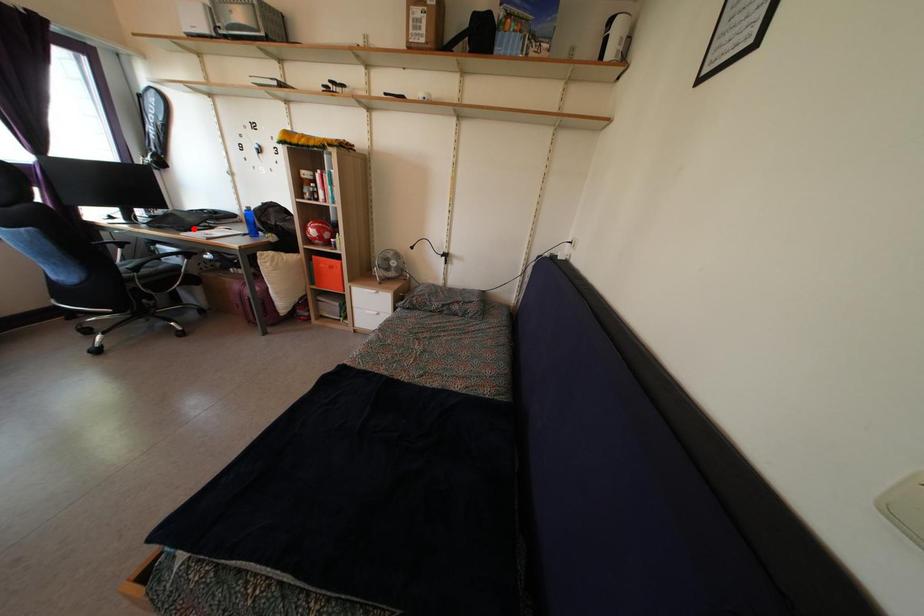
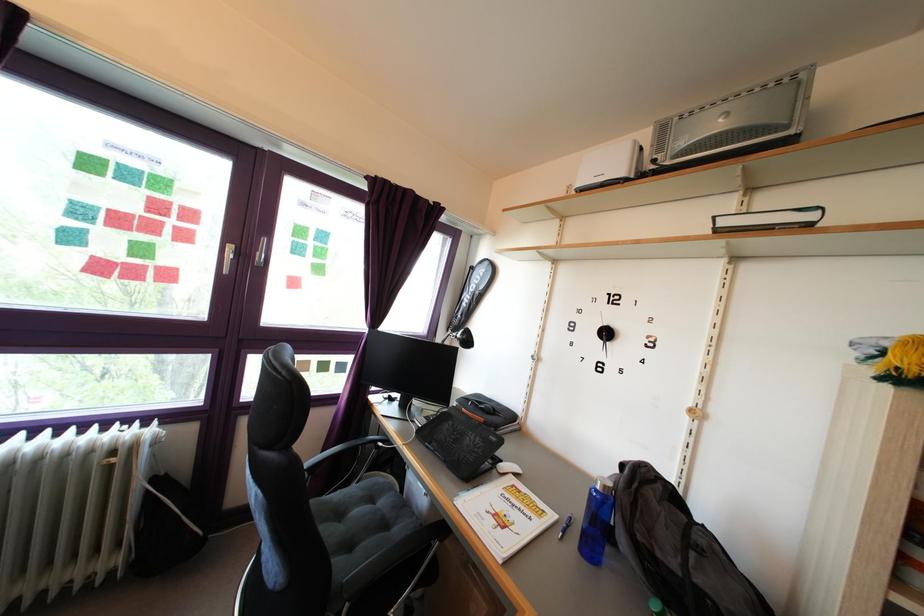
The point at the highlighted location is marked in the first image. Where is the corresponding point in the second image?

(472, 447)